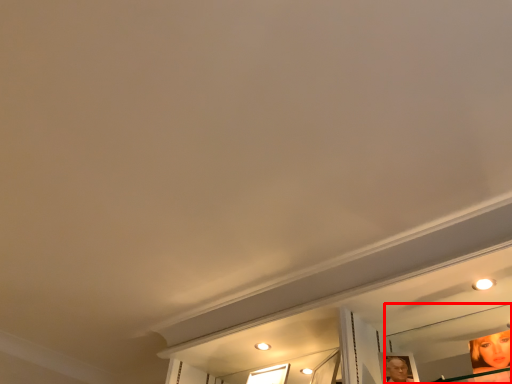
Question: From the image's perspective, where is mirror (annotated by the red box) located relative to window?

Choices:
 (A) below
 (B) above

Answer: (B)